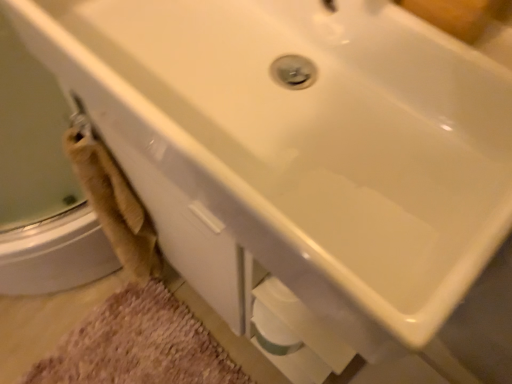
Question: Is point (39, 74) closer or farther from the camera than point (47, 379)?

Choices:
 (A) farther
 (B) closer

Answer: (B)

Question: Do you think beige fabric towel at left is within beige shaggy bath mat at lower left, or outside of it?

Choices:
 (A) inside
 (B) outside

Answer: (B)

Question: From the image's perspective, is beige fabric towel at left above or below beige shaggy bath mat at lower left?

Choices:
 (A) below
 (B) above

Answer: (B)

Question: From the image's perspective, is beige shaggy bath mat at lower left above or below beige fabric towel at left?

Choices:
 (A) below
 (B) above

Answer: (A)

Question: Is point (139, 337) positioned closer to the camera than point (62, 226)?

Choices:
 (A) farther
 (B) closer

Answer: (A)

Question: Considering the positions of beige shaggy bath mat at lower left and beige fabric towel at left in the image, is beige shaggy bath mat at lower left bigger or smaller than beige fabric towel at left?

Choices:
 (A) big
 (B) small

Answer: (B)

Question: Looking at their shapes, would you say beige shaggy bath mat at lower left is wider or thinner than beige fabric towel at left?

Choices:
 (A) wide
 (B) thin

Answer: (A)